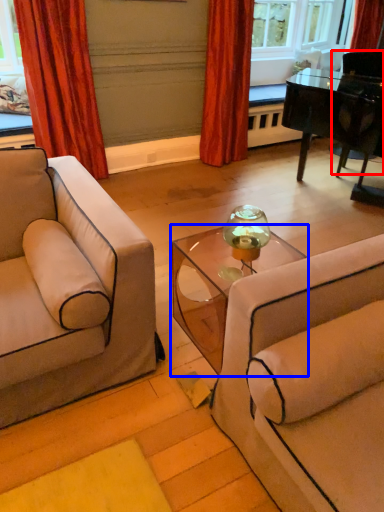
Question: Which object is closer to the camera taking this photo, armchair (highlighted by a red box) or table (highlighted by a blue box)?

Choices:
 (A) armchair
 (B) table

Answer: (B)